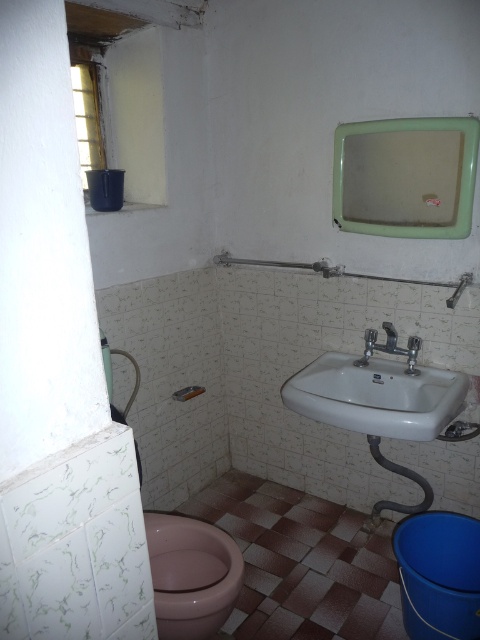
Question: Which of these objects is positioned farthest from the pink glossy toilet bowl at lower left?

Choices:
 (A) white glossy sink at lower right
 (B) silver metallic faucet at sink right

Answer: (B)

Question: Can you confirm if pink glossy toilet bowl at lower left is thinner than silver metallic faucet at sink right?

Choices:
 (A) no
 (B) yes

Answer: (A)

Question: Considering the relative positions of green plastic mirror at upper center and pink glossy toilet bowl at lower left in the image provided, where is green plastic mirror at upper center located with respect to pink glossy toilet bowl at lower left?

Choices:
 (A) left
 (B) right

Answer: (B)

Question: Is green plastic mirror at upper center to the left of pink glossy toilet bowl at lower left from the viewer's perspective?

Choices:
 (A) yes
 (B) no

Answer: (B)

Question: Which point appears closest to the camera in this image?

Choices:
 (A) coord(383,349)
 (B) coord(292,385)
 (C) coord(350,150)

Answer: (B)

Question: Which object is positioned closest to the pink glossy toilet bowl at lower left?

Choices:
 (A) green plastic mirror at upper center
 (B) silver metallic faucet at sink right
 (C) white glossy sink at lower right

Answer: (C)